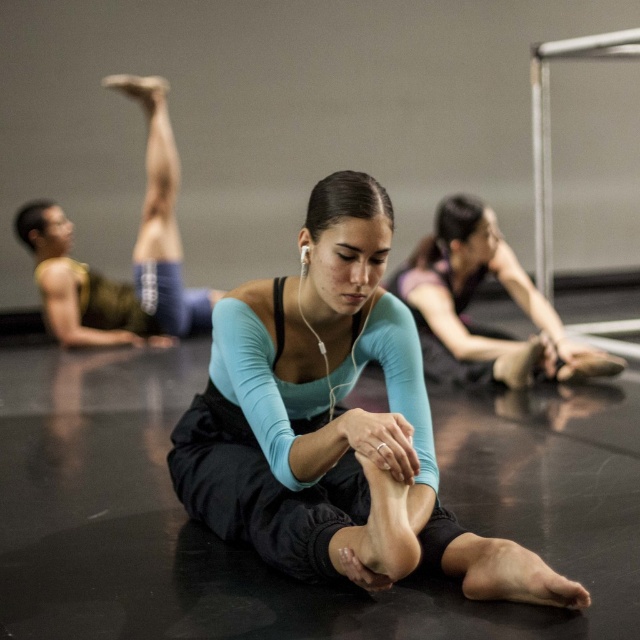
You are a dance instructor observing the stretching session in the studio. You notice two participants wearing leggings of different colors and sizes. Which participant wearing either the teal matte leggings at center or the matte blue leggings at center has the larger pair of leggings?

The teal matte leggings at center is bigger than matte blue leggings at center, so the participant wearing the teal matte leggings at center has the larger pair of leggings.

You are a dance instructor observing the studio. You notice two items labeled as matte blue tights at upper left and matte blue leggings at center. Which one has a larger size?

The matte blue tights at upper left is bigger than matte blue leggings at center.